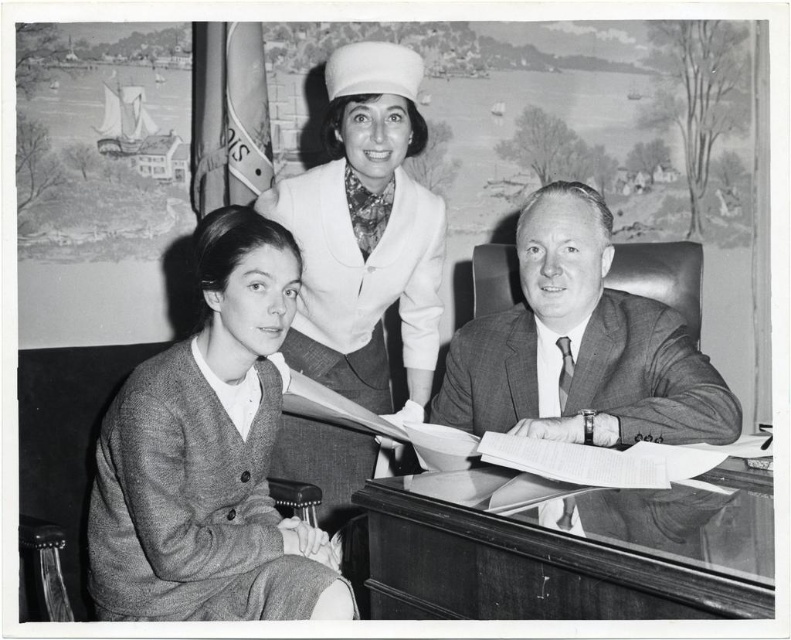
Question: Which object is the closest to the textured gray cardigan at left?

Choices:
 (A) smooth gray suit at center
 (B) smooth white hat at upper center
 (C) transparent glass table at center

Answer: (B)

Question: Does textured gray cardigan at left lie in front of smooth gray suit at center?

Choices:
 (A) no
 (B) yes

Answer: (B)

Question: Is smooth white hat at upper center positioned before smooth gray suit at center?

Choices:
 (A) no
 (B) yes

Answer: (A)

Question: Among these points, which one is farthest from the camera?

Choices:
 (A) (543, 429)
 (B) (214, 301)

Answer: (B)

Question: Can you confirm if smooth white hat at upper center is positioned to the right of smooth gray suit at center?

Choices:
 (A) no
 (B) yes

Answer: (A)

Question: Which point is farther from the camera taking this photo?

Choices:
 (A) (706, 497)
 (B) (292, 538)

Answer: (B)